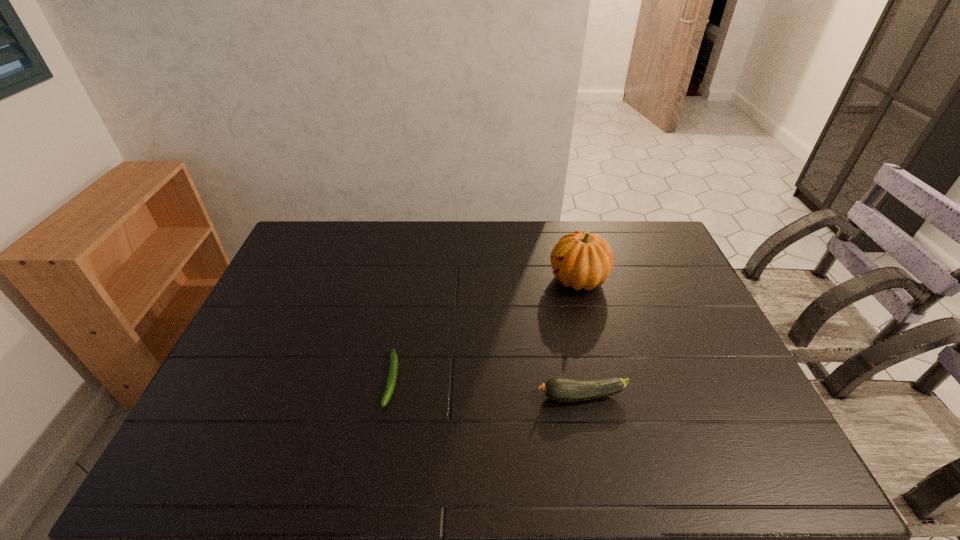
Locate an element on the screen. The width and height of the screenshot is (960, 540). the farthest object is located at coordinates (582, 260).

Find the location of a particular element. the tallest object is located at coordinates (582, 260).

Identify the location of the taller zucchini. The height and width of the screenshot is (540, 960). 558,389.

The height and width of the screenshot is (540, 960). I want to click on the second tallest object, so click(x=558, y=389).

Where is `the leftmost object`? This screenshot has width=960, height=540. the leftmost object is located at coordinates (393, 361).

Identify the location of the shortest object. The height and width of the screenshot is (540, 960). (393, 361).

The width and height of the screenshot is (960, 540). I want to click on vacant area situated 0.220m on the carved face of the farthest object, so click(483, 280).

I want to click on free location located 0.270m on the carved face of the farthest object, so click(468, 280).

At what (x,y) coordinates should I click in order to perform the action: click on vacant space positioned on the carved face of the farthest object. Please return your answer as a coordinate pair (x, y). The width and height of the screenshot is (960, 540). Looking at the image, I should click on (462, 280).

Find the location of a particular element. Image resolution: width=960 pixels, height=540 pixels. vacant space located 0.260m at the blossom end of the second shortest object is located at coordinates (435, 396).